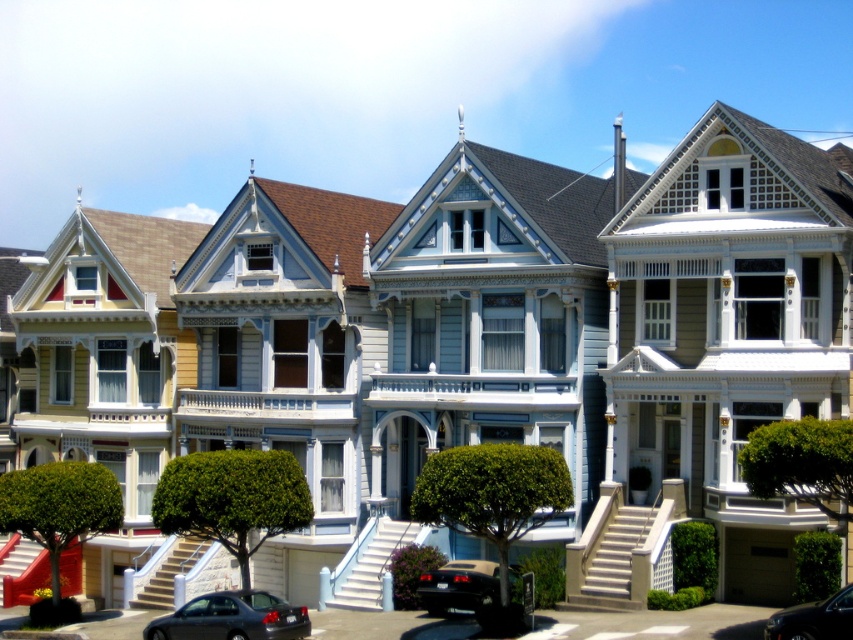
Question: Which point is farther to the camera?

Choices:
 (A) (512, 582)
 (B) (206, 605)

Answer: (A)

Question: Observing the image, what is the correct spatial positioning of shiny black sedan at lower left in reference to shiny black car at center?

Choices:
 (A) below
 (B) above

Answer: (A)

Question: Can you confirm if shiny black sedan at lower left is positioned to the left of shiny black car at lower center?

Choices:
 (A) yes
 (B) no

Answer: (A)

Question: Which is nearer to the shiny black sedan at lower left?

Choices:
 (A) shiny black car at lower center
 (B) shiny black car at center

Answer: (A)

Question: Based on their relative distances, which object is nearer to the shiny black car at lower center?

Choices:
 (A) shiny black car at center
 (B) shiny black sedan at lower left

Answer: (B)

Question: Does shiny black sedan at lower left appear on the left side of shiny black car at lower center?

Choices:
 (A) no
 (B) yes

Answer: (B)